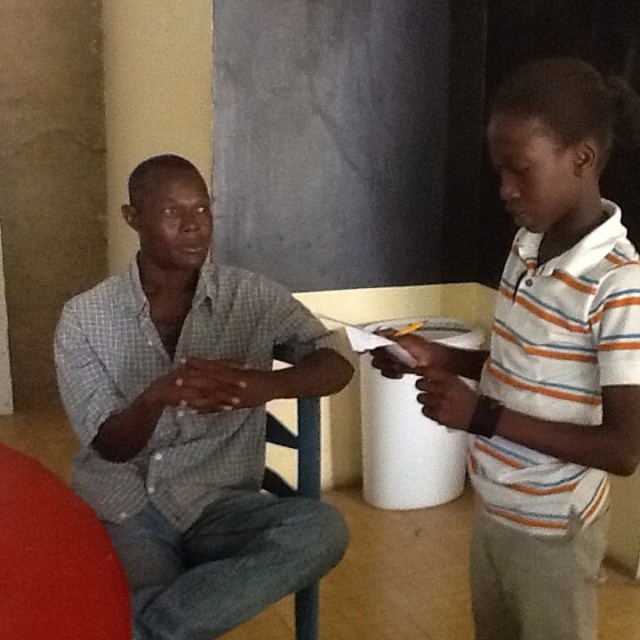
Question: Considering the relative positions of checkered fabric shirt at left and white striped shirt at right in the image provided, where is checkered fabric shirt at left located with respect to white striped shirt at right?

Choices:
 (A) above
 (B) below

Answer: (B)

Question: Does checkered fabric shirt at left have a lesser width compared to white striped shirt at right?

Choices:
 (A) yes
 (B) no

Answer: (B)

Question: Which point appears closest to the camera in this image?

Choices:
 (A) (541, 237)
 (B) (230, 381)

Answer: (A)

Question: Can you confirm if checkered fabric shirt at left is positioned above white striped shirt at right?

Choices:
 (A) yes
 (B) no

Answer: (B)